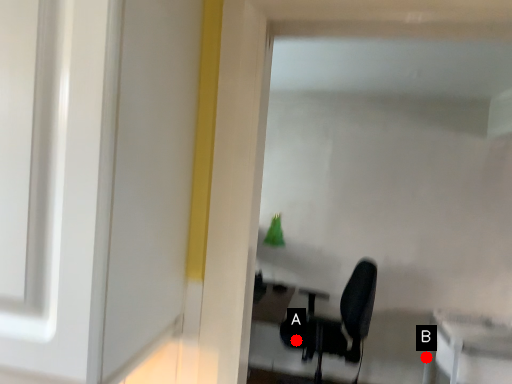
Question: Two points are circled on the image, labeled by A and B beside each circle. Which point is closer to the camera?

Choices:
 (A) A is closer
 (B) B is closer

Answer: (A)